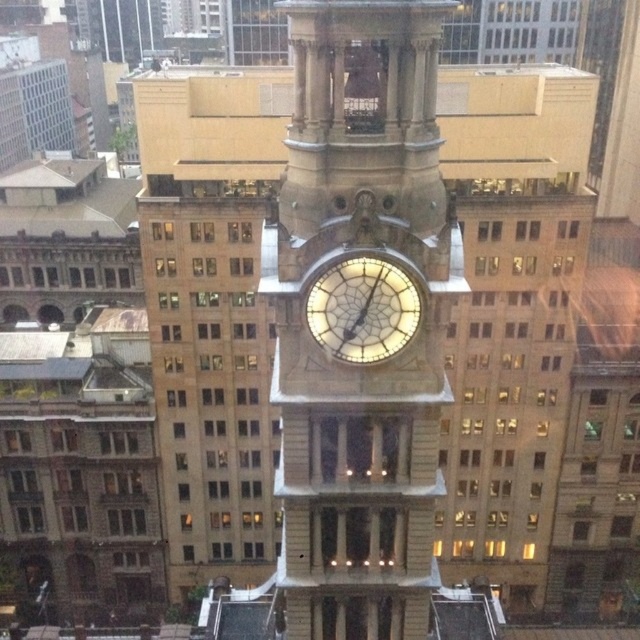
Based on the photo, you are a tourist standing in the square and want to take a photo of both the golden stone clock tower at center and the illuminated glass clock at center. Which clock should you focus on first if you want to capture both in the same frame?

The golden stone clock tower at center is located below the illuminated glass clock at center, so you should focus on the illuminated glass clock at center first to ensure both are in the frame.

You are standing in the urban area and want to locate the golden stone clock tower at center. According to the coordinates provided, where exactly is it positioned?

The golden stone clock tower at center is located at point (360, 317), which means it is positioned near the center of the image.